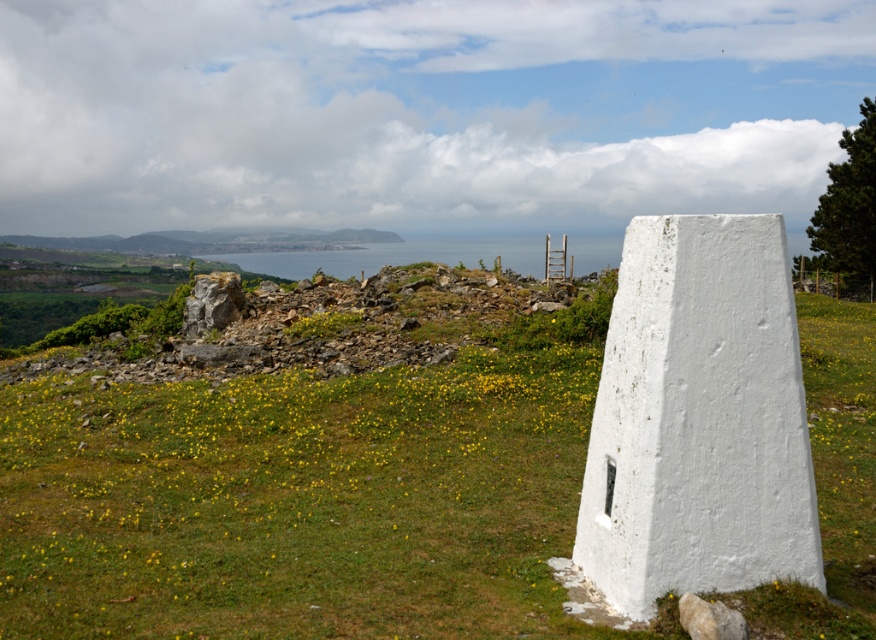
Can you confirm if white painted stone obelisk at center is wider than green grassy hillside at lower left?

Incorrect, white painted stone obelisk at center's width does not surpass green grassy hillside at lower left's.

Does point (781, 458) lie behind point (88, 237)?

No, it is in front of (88, 237).

Measure the distance between white painted stone obelisk at center and camera.

white painted stone obelisk at center and camera are 17.73 feet apart.

Where is `white painted stone obelisk at center`? This screenshot has height=640, width=876. white painted stone obelisk at center is located at coordinates (698, 419).

Does point (99, 560) lie in front of point (325, 240)?

Yes, it is in front of point (325, 240).

Consider the image. Can you confirm if green grass at center is positioned below green grassy hillside at lower left?

Indeed, green grass at center is positioned under green grassy hillside at lower left.

Does point (852, 458) lie behind point (223, 252)?

No, (852, 458) is closer to viewer.

This screenshot has width=876, height=640. In order to click on green grass at center in this screenshot , I will do `click(297, 500)`.

Is green grass at center smaller than white painted stone obelisk at center?

Incorrect, green grass at center is not smaller in size than white painted stone obelisk at center.

Is point (516, 330) closer to camera compared to point (636, 291)?

No, it is behind (636, 291).

At what (x,y) coordinates should I click in order to perform the action: click on green grass at center. Please return your answer as a coordinate pair (x, y). Looking at the image, I should click on (297, 500).